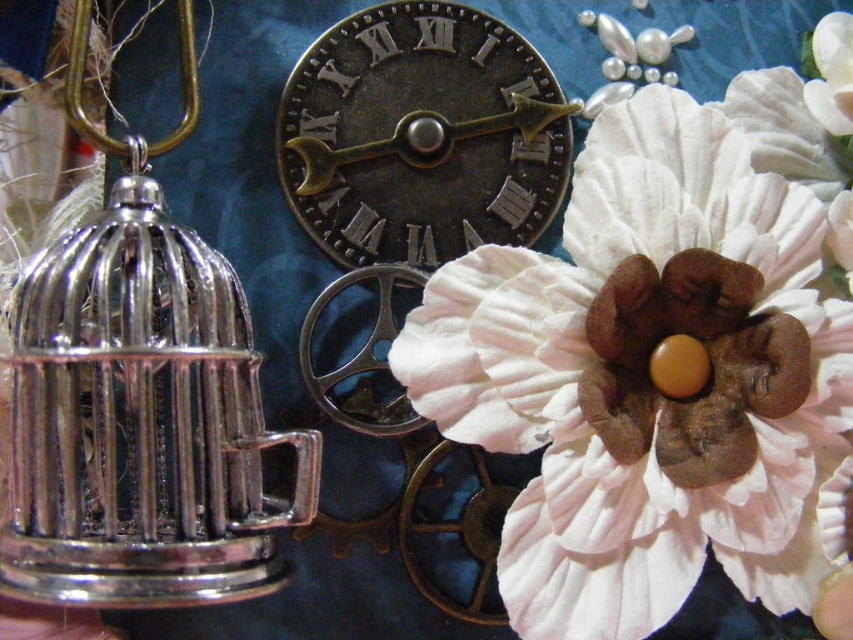
You are an interior designer arranging items on a shelf. You have a white fabric flower at upper right and an antique brass clock at center. Which item should you place closer to the edge of the shelf to ensure they both fit without overlapping?

The white fabric flower at upper right might be wider than the antique brass clock at center, so placing the flower closer to the edge would allow more space between them, preventing overlap.

In the scene shown: You are standing in front of the image and notice a point at coordinates (647, 378). Based on the scene described, can you identify what object this point is located on?

The point at coordinates (647, 378) is located on the white fabric flower at upper right.

You are an interior designer arranging items on a shelf. You have the white fabric flower at upper right and the antique brass clock at center. Which item should you place closer to the front of the shelf to maintain the current perspective?

The white fabric flower at upper right should be placed closer to the front of the shelf since it is closer to the viewer than the antique brass clock at center in the original arrangement.